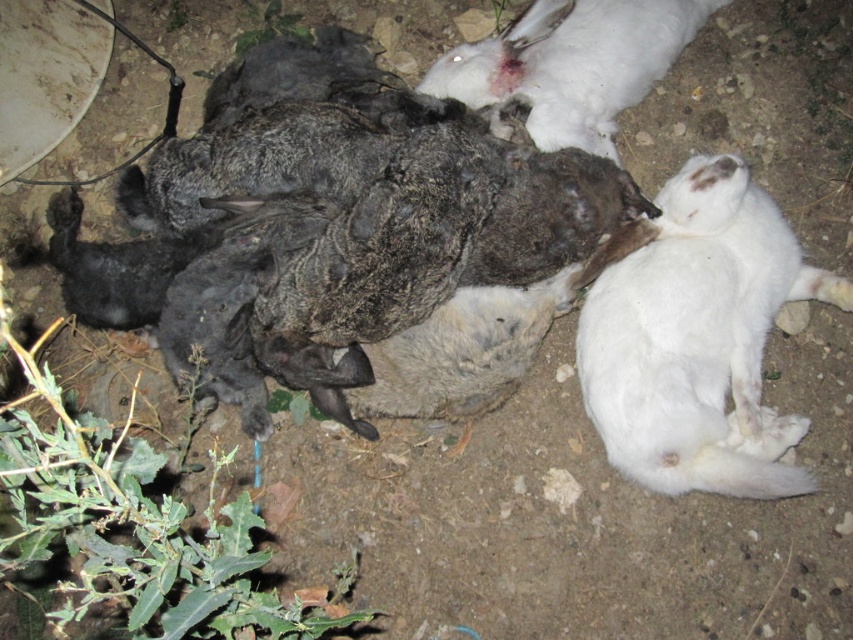
Question: Is white fur cat at right smaller than white fur rabbit at upper right?

Choices:
 (A) yes
 (B) no

Answer: (B)

Question: Which of the following is the closest to the observer?

Choices:
 (A) (691, 180)
 (B) (569, 92)

Answer: (A)

Question: Can you confirm if white fur cat at right is bigger than white fur rabbit at upper right?

Choices:
 (A) no
 (B) yes

Answer: (B)

Question: Which object is farther from the camera taking this photo?

Choices:
 (A) white fur cat at right
 (B) white fur rabbit at upper right

Answer: (B)

Question: Can you confirm if white fur cat at right is positioned to the left of white fur rabbit at upper right?

Choices:
 (A) yes
 (B) no

Answer: (B)